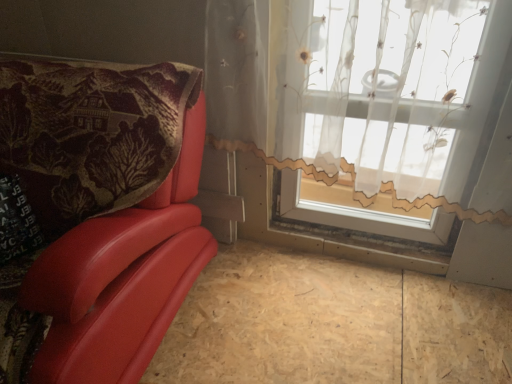
Question: Is translucent floral-patterned curtain at upper right positioned in front of plywood at lower left?

Choices:
 (A) yes
 (B) no

Answer: (A)

Question: From the image's perspective, is translucent floral-patterned curtain at upper right located above plywood at lower left?

Choices:
 (A) yes
 (B) no

Answer: (A)

Question: Does translucent floral-patterned curtain at upper right appear on the right side of plywood at lower left?

Choices:
 (A) yes
 (B) no

Answer: (A)

Question: Is plywood at lower left at the back of translucent floral-patterned curtain at upper right?

Choices:
 (A) yes
 (B) no

Answer: (B)

Question: Is translucent floral-patterned curtain at upper right far away from plywood at lower left?

Choices:
 (A) no
 (B) yes

Answer: (A)

Question: Considering the positions of plywood at lower left and matte red leather chair at left in the image, is plywood at lower left bigger or smaller than matte red leather chair at left?

Choices:
 (A) small
 (B) big

Answer: (A)

Question: In the image, is plywood at lower left positioned in front of or behind matte red leather chair at left?

Choices:
 (A) front
 (B) behind

Answer: (B)

Question: In terms of height, does plywood at lower left look taller or shorter compared to matte red leather chair at left?

Choices:
 (A) short
 (B) tall

Answer: (A)

Question: Considering the relative positions of plywood at lower left and matte red leather chair at left in the image provided, is plywood at lower left to the left or to the right of matte red leather chair at left?

Choices:
 (A) left
 (B) right

Answer: (B)

Question: Is point (348, 327) positioned closer to the camera than point (473, 16)?

Choices:
 (A) closer
 (B) farther

Answer: (B)

Question: From the image's perspective, is plywood at lower left above or below translucent floral-patterned curtain at upper right?

Choices:
 (A) above
 (B) below

Answer: (B)

Question: In terms of size, does plywood at lower left appear bigger or smaller than translucent floral-patterned curtain at upper right?

Choices:
 (A) big
 (B) small

Answer: (B)

Question: Relative to translucent floral-patterned curtain at upper right, is plywood at lower left in front or behind?

Choices:
 (A) behind
 (B) front

Answer: (A)

Question: From the image's perspective, is matte red leather chair at left located above or below plywood at lower left?

Choices:
 (A) above
 (B) below

Answer: (A)

Question: Based on their sizes in the image, would you say matte red leather chair at left is bigger or smaller than plywood at lower left?

Choices:
 (A) big
 (B) small

Answer: (A)